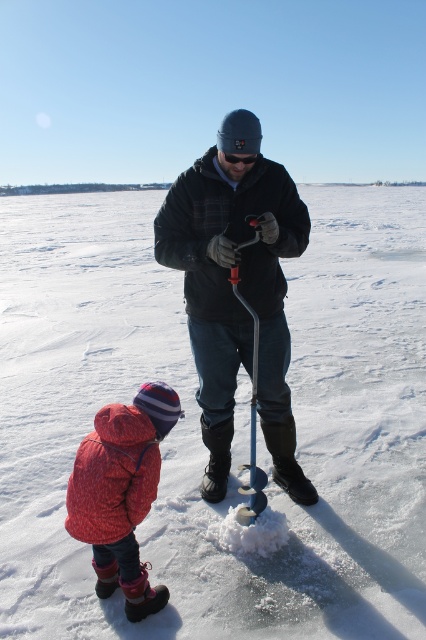
Is matte black jacket at center bigger than fluffy pink coat at lower left?

Correct, matte black jacket at center is larger in size than fluffy pink coat at lower left.

Between point (284, 209) and point (127, 557), which one is positioned behind?

The point (284, 209) is behind.

Is point (287, 188) positioned behind point (123, 589)?

Yes, it is.

The width and height of the screenshot is (426, 640). I want to click on matte black jacket at center, so click(x=239, y=289).

What do you see at coordinates (235, 424) in the screenshot? I see `white powdery snow at center` at bounding box center [235, 424].

Between white powdery snow at center and metallic blue ski pole at center, which one is positioned lower?

metallic blue ski pole at center is below.

Find the location of a particular element. This screenshot has width=426, height=640. white powdery snow at center is located at coordinates (235, 424).

Identify the location of white powdery snow at center. Image resolution: width=426 pixels, height=640 pixels. (235, 424).

Who is more forward, (186, 237) or (241, 246)?

Point (241, 246) is more forward.

Where is `matte black jacket at center`? matte black jacket at center is located at coordinates (239, 289).